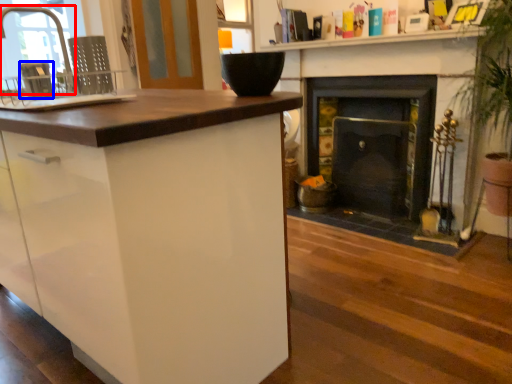
Question: Which object is closer to the camera taking this photo, faucet (highlighted by a red box) or appliance (highlighted by a blue box)?

Choices:
 (A) faucet
 (B) appliance

Answer: (B)